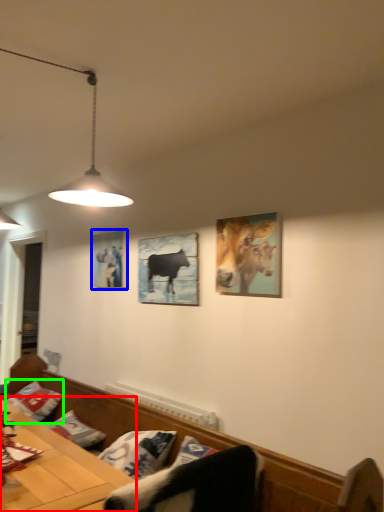
Question: Estimate the real-world distances between objects in this image. Which object is closer to table (highlighted by a red box), picture frame (highlighted by a blue box) or pillow (highlighted by a green box)?

Choices:
 (A) picture frame
 (B) pillow

Answer: (B)